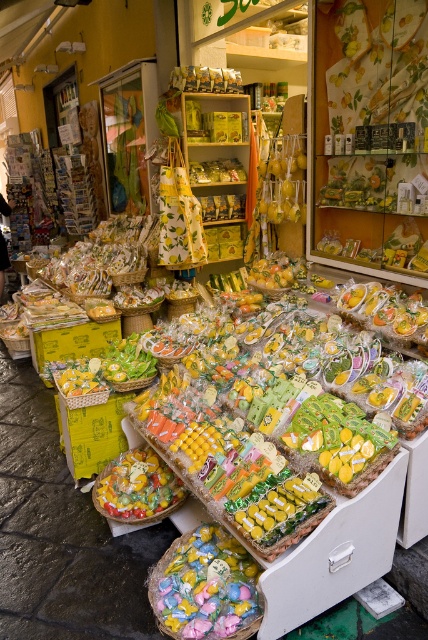
Question: Which object is farther from the camera taking this photo?

Choices:
 (A) translucent plastic candy at center
 (B) pastel candy at center

Answer: (A)

Question: Where is pastel candy at center located in relation to translucent plastic candy at center in the image?

Choices:
 (A) left
 (B) right

Answer: (B)

Question: Does pastel candy at center appear over translucent plastic candy at center?

Choices:
 (A) no
 (B) yes

Answer: (A)

Question: Which object appears farthest from the camera in this image?

Choices:
 (A) pastel candy at center
 (B) translucent plastic candy at center

Answer: (B)

Question: Does pastel candy at center have a lesser width compared to translucent plastic candy at center?

Choices:
 (A) yes
 (B) no

Answer: (A)

Question: Among these objects, which one is nearest to the camera?

Choices:
 (A) translucent plastic candy at center
 (B) pastel candy at center

Answer: (B)